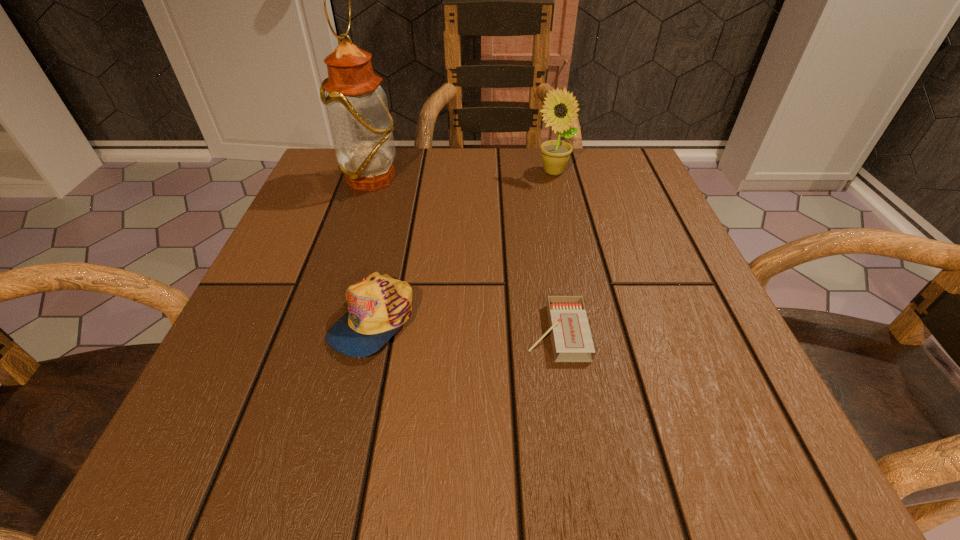
The height and width of the screenshot is (540, 960). In order to click on oil lamp present at the far edge in this screenshot , I will do `click(362, 128)`.

The image size is (960, 540). Identify the location of sunflower that is at the far edge. (560, 110).

The width and height of the screenshot is (960, 540). In order to click on oil lamp that is positioned at the left edge in this screenshot , I will do `click(362, 128)`.

Identify the location of cap present at the left edge. This screenshot has width=960, height=540. (378, 305).

At what (x,y) coordinates should I click in order to perform the action: click on object positioned at the far left corner. Please return your answer as a coordinate pair (x, y). Image resolution: width=960 pixels, height=540 pixels. Looking at the image, I should click on (362, 128).

What are the coordinates of `free point at the far edge` in the screenshot? It's located at (571, 182).

In the image, there is a desktop. Identify the location of free space at the near edge. (404, 418).

I want to click on vacant space at the left edge, so click(x=312, y=220).

The height and width of the screenshot is (540, 960). In order to click on free space at the right edge of the desktop in this screenshot , I will do `click(677, 356)`.

Locate an element on the screen. vacant space at the far left corner of the desktop is located at coordinates (324, 183).